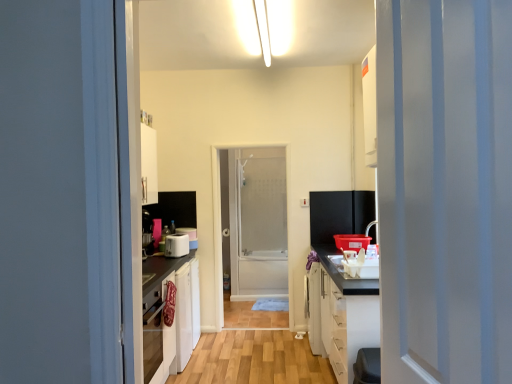
Question: Considering the relative positions of white plastic toaster at center, arranged as the first appliance when viewed from the front, and wooden floor at center in the image provided, is white plastic toaster at center, arranged as the first appliance when viewed from the front, to the left or to the right of wooden floor at center?

Choices:
 (A) right
 (B) left

Answer: (B)

Question: Looking at their shapes, would you say white plastic toaster at center, arranged as the first appliance when viewed from the front, is wider or thinner than wooden floor at center?

Choices:
 (A) wide
 (B) thin

Answer: (B)

Question: Which is nearer to the wooden floor at center?

Choices:
 (A) frosted glass screen door at center
 (B) white plastic toaster at center, which ranks as the 2th appliance in back-to-front order
 (C) white plastic electric outlet at center
 (D) white plastic toaster at center, which is counted as the 1th appliance, starting from the back
 (E) white matte cabinet at right

Answer: (E)

Question: Estimate the real-world distances between objects in this image. Which object is farther from the white matte cabinet at right?

Choices:
 (A) white plastic electric outlet at center
 (B) white glossy door at right
 (C) white plastic toaster at center, arranged as the first appliance when viewed from the front
 (D) frosted glass screen door at center
 (E) wooden floor at center

Answer: (D)